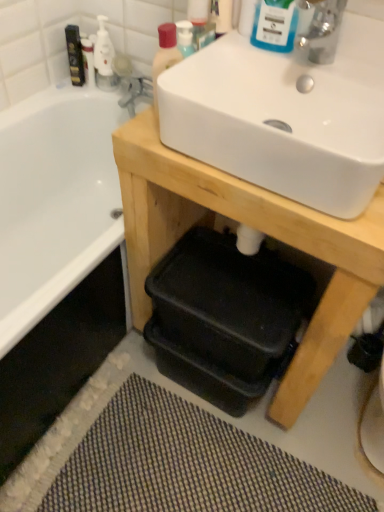
Question: From a real-world perspective, is matte plastic bottle at upper center physically above white glossy bottle at upper left?

Choices:
 (A) no
 (B) yes

Answer: (B)

Question: From the image's perspective, does matte plastic bottle at upper center appear higher than white glossy bottle at upper left?

Choices:
 (A) yes
 (B) no

Answer: (B)

Question: Is matte plastic bottle at upper center smaller than white glossy bottle at upper left?

Choices:
 (A) yes
 (B) no

Answer: (A)

Question: From the image's perspective, is matte plastic bottle at upper center under white glossy bottle at upper left?

Choices:
 (A) yes
 (B) no

Answer: (A)

Question: Is matte plastic bottle at upper center bigger than white glossy bottle at upper left?

Choices:
 (A) no
 (B) yes

Answer: (A)

Question: Considering the relative sizes of matte plastic bottle at upper center and white glossy bottle at upper left in the image provided, is matte plastic bottle at upper center thinner than white glossy bottle at upper left?

Choices:
 (A) no
 (B) yes

Answer: (A)

Question: Is the depth of silver metallic faucet at upper right greater than that of white glossy sink at upper center?

Choices:
 (A) no
 (B) yes

Answer: (B)

Question: From the image's perspective, is silver metallic faucet at upper right beneath white glossy sink at upper center?

Choices:
 (A) no
 (B) yes

Answer: (A)

Question: Considering the relative positions of silver metallic faucet at upper right and white glossy sink at upper center in the image provided, is silver metallic faucet at upper right to the left of white glossy sink at upper center from the viewer's perspective?

Choices:
 (A) no
 (B) yes

Answer: (A)

Question: Are silver metallic faucet at upper right and white glossy sink at upper center located far from each other?

Choices:
 (A) no
 (B) yes

Answer: (A)

Question: From a real-world perspective, is silver metallic faucet at upper right under white glossy sink at upper center?

Choices:
 (A) no
 (B) yes

Answer: (A)

Question: Considering the relative sizes of silver metallic faucet at upper right and white glossy sink at upper center in the image provided, is silver metallic faucet at upper right wider than white glossy sink at upper center?

Choices:
 (A) yes
 (B) no

Answer: (B)

Question: Can you confirm if matte black mouthwash at upper left, acting as the second mouthwash starting from the bottom, is smaller than textured gray bath mat at lower center?

Choices:
 (A) no
 (B) yes

Answer: (B)